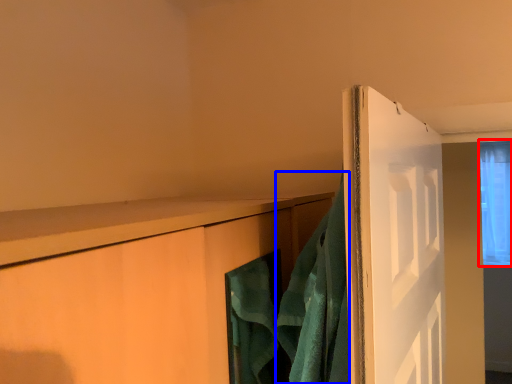
Question: Which of the following is the farthest to the observer, window (highlighted by a red box) or bath towel (highlighted by a blue box)?

Choices:
 (A) window
 (B) bath towel

Answer: (A)